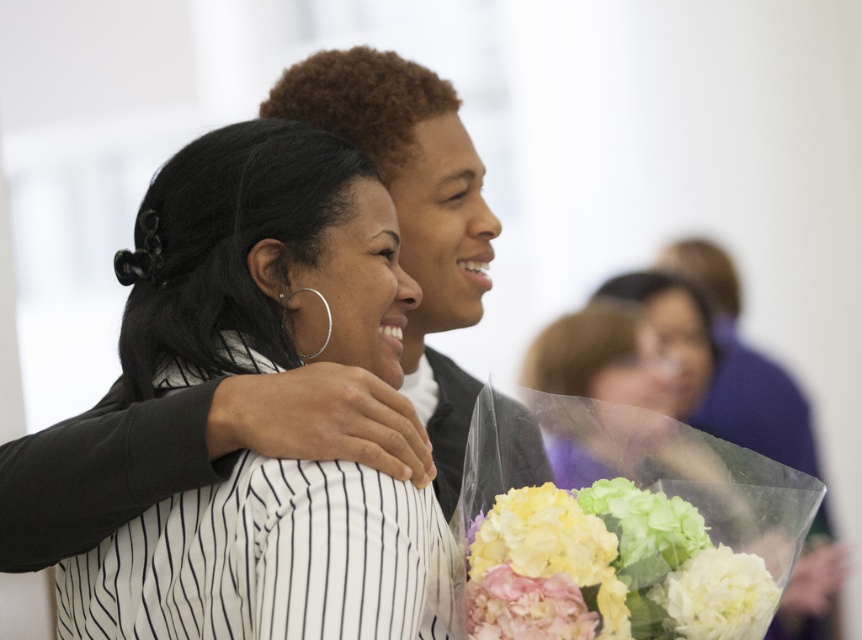
Question: Does pastel hydrangea bouquet at lower right have a lesser width compared to white matte bouquet at lower right?

Choices:
 (A) yes
 (B) no

Answer: (B)

Question: Is black matte hair at center wider than white matte bouquet at lower right?

Choices:
 (A) no
 (B) yes

Answer: (B)

Question: Which point appears closest to the camera in this image?

Choices:
 (A) (565, 596)
 (B) (409, 282)
 (C) (628, 572)

Answer: (A)

Question: Is white matte bouquet at lower right bigger than pink silk flower at lower center?

Choices:
 (A) no
 (B) yes

Answer: (B)

Question: Which of the following is the closest to the observer?

Choices:
 (A) white matte bouquet at lower right
 (B) pink silk flower at lower center

Answer: (B)

Question: Which of the following is the farthest from the observer?

Choices:
 (A) (763, 579)
 (B) (139, 320)
 (C) (557, 582)
 (D) (579, 564)

Answer: (B)